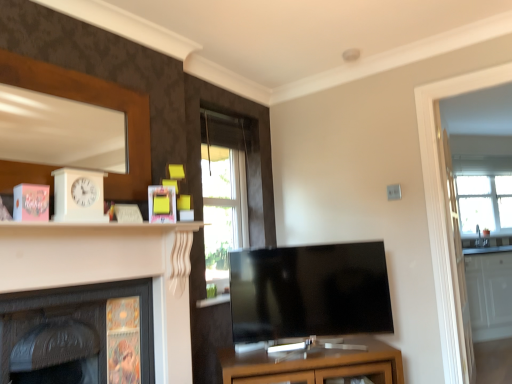
Question: Is transparent glass door at right not close to yellow matte picture frame at upper center?

Choices:
 (A) yes
 (B) no

Answer: (A)

Question: Considering the relative positions of transparent glass door at right and yellow matte picture frame at upper center in the image provided, is transparent glass door at right behind yellow matte picture frame at upper center?

Choices:
 (A) no
 (B) yes

Answer: (B)

Question: Is transparent glass door at right directly adjacent to yellow matte picture frame at upper center?

Choices:
 (A) yes
 (B) no

Answer: (B)

Question: Does transparent glass door at right appear on the left side of yellow matte picture frame at upper center?

Choices:
 (A) yes
 (B) no

Answer: (B)

Question: Considering the relative sizes of transparent glass door at right and yellow matte picture frame at upper center in the image provided, is transparent glass door at right smaller than yellow matte picture frame at upper center?

Choices:
 (A) yes
 (B) no

Answer: (B)

Question: From a real-world perspective, does transparent glass door at right stand above yellow matte picture frame at upper center?

Choices:
 (A) no
 (B) yes

Answer: (A)

Question: Is clear glass window at center, marked as the 1th window in a front-to-back arrangement, next to white glossy fireplace at left, which is the 2th fireplace from left to right, and touching it?

Choices:
 (A) yes
 (B) no

Answer: (B)

Question: Can you confirm if clear glass window at center, placed as the second window when sorted from right to left, is taller than white glossy fireplace at left, positioned as the first fireplace in right-to-left order?

Choices:
 (A) no
 (B) yes

Answer: (B)

Question: From the image's perspective, is clear glass window at center, positioned as the 2th window in back-to-front order, under white glossy fireplace at left, which is the 2th fireplace from left to right?

Choices:
 (A) yes
 (B) no

Answer: (B)

Question: From a real-world perspective, is clear glass window at center, which is the first window in left-to-right order, on top of white glossy fireplace at left, positioned as the first fireplace in right-to-left order?

Choices:
 (A) no
 (B) yes

Answer: (B)

Question: From the image's perspective, is clear glass window at center, placed as the second window when sorted from right to left, on top of white glossy fireplace at left, positioned as the first fireplace in right-to-left order?

Choices:
 (A) no
 (B) yes

Answer: (B)

Question: Is clear glass window at center, placed as the second window when sorted from right to left, positioned with its back to white glossy fireplace at left, positioned as the first fireplace in right-to-left order?

Choices:
 (A) no
 (B) yes

Answer: (A)

Question: Is yellow matte picture frame at upper center at the left side of matte brown cabinet at center?

Choices:
 (A) yes
 (B) no

Answer: (A)